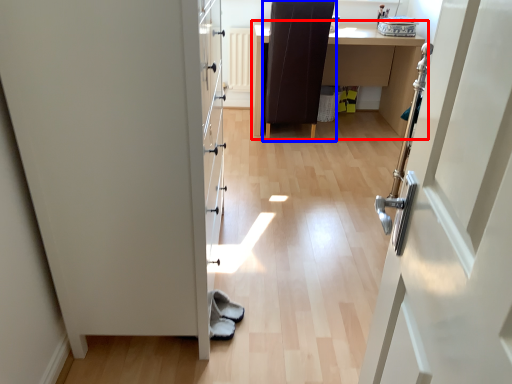
Question: Which object is closer to the camera taking this photo, table (highlighted by a red box) or chair (highlighted by a blue box)?

Choices:
 (A) table
 (B) chair

Answer: (B)